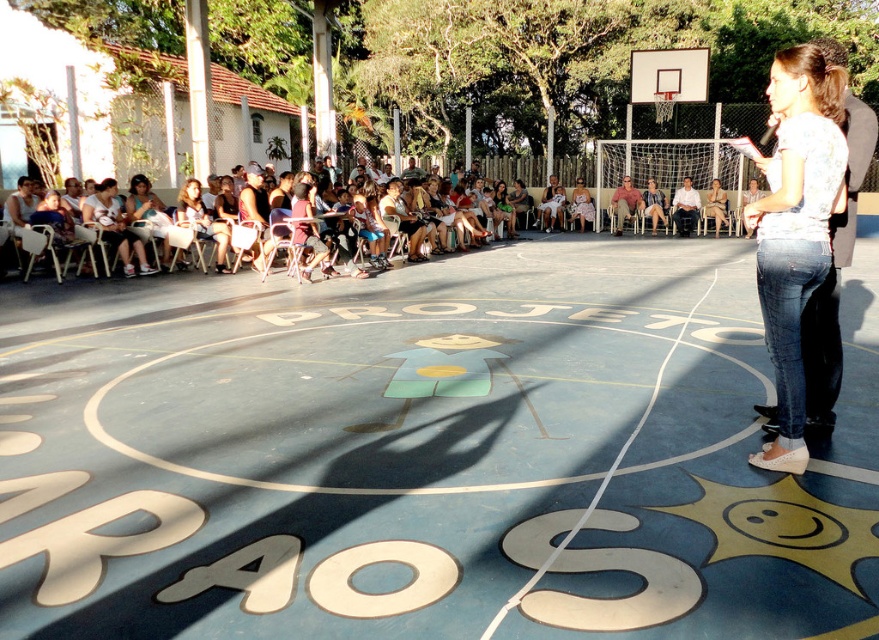
Question: Which of the following is the farthest from the observer?

Choices:
 (A) blue rubber basketball court at center
 (B) white printed blouse at center

Answer: (B)

Question: Does white printed blouse at center appear under metallic silver basketball hoop at upper center?

Choices:
 (A) no
 (B) yes

Answer: (B)

Question: Which of the following is the farthest from the observer?

Choices:
 (A) metallic silver basketball hoop at upper center
 (B) white printed blouse at center

Answer: (A)

Question: Which object is the closest to the metallic silver basketball hoop at upper center?

Choices:
 (A) blue rubber basketball court at center
 (B) matte pink dress at center

Answer: (A)

Question: Is blue rubber basketball court at center positioned behind matte pink dress at center?

Choices:
 (A) yes
 (B) no

Answer: (B)

Question: Does blue rubber basketball court at center appear on the left side of white printed blouse at center?

Choices:
 (A) no
 (B) yes

Answer: (B)